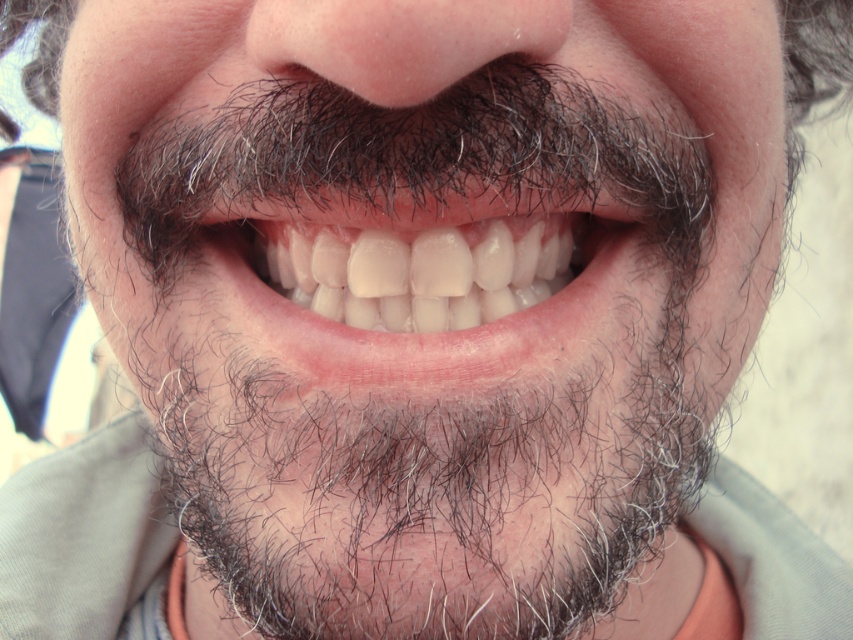
Question: Does natural white teeth at center lie in front of gray beard at lower center?

Choices:
 (A) yes
 (B) no

Answer: (A)

Question: Considering the relative positions of natural white teeth at center and gray beard at lower center in the image provided, where is natural white teeth at center located with respect to gray beard at lower center?

Choices:
 (A) below
 (B) above

Answer: (B)

Question: Which point is closer to the camera?

Choices:
 (A) natural white teeth at center
 (B) gray beard at lower center

Answer: (A)

Question: Does natural white teeth at center appear on the left side of gray beard at lower center?

Choices:
 (A) no
 (B) yes

Answer: (A)